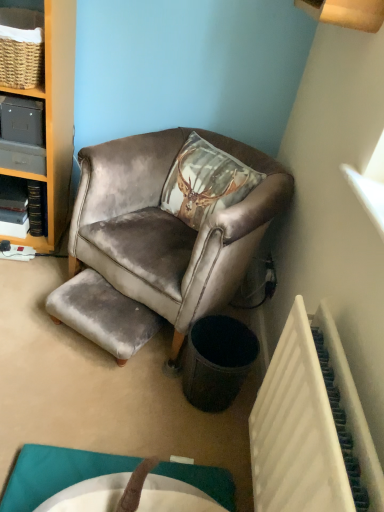
Question: Is velvet brown armchair at center wider or thinner than matte gray cabinet at left?

Choices:
 (A) thin
 (B) wide

Answer: (B)

Question: In the image, is velvet brown armchair at center positioned in front of or behind matte gray cabinet at left?

Choices:
 (A) behind
 (B) front

Answer: (B)

Question: Based on their relative distances, which object is farther from the matte gray cabinet at left?

Choices:
 (A) velvet grey stool at lower left
 (B) black textured trash bin at lower right
 (C) velvet brown armchair at center
 (D) white plastic radiator at lower right

Answer: (D)

Question: Considering the real-world distances, which object is closest to the matte gray cabinet at left?

Choices:
 (A) velvet grey stool at lower left
 (B) black textured trash bin at lower right
 (C) velvet brown armchair at center
 (D) white plastic radiator at lower right

Answer: (C)